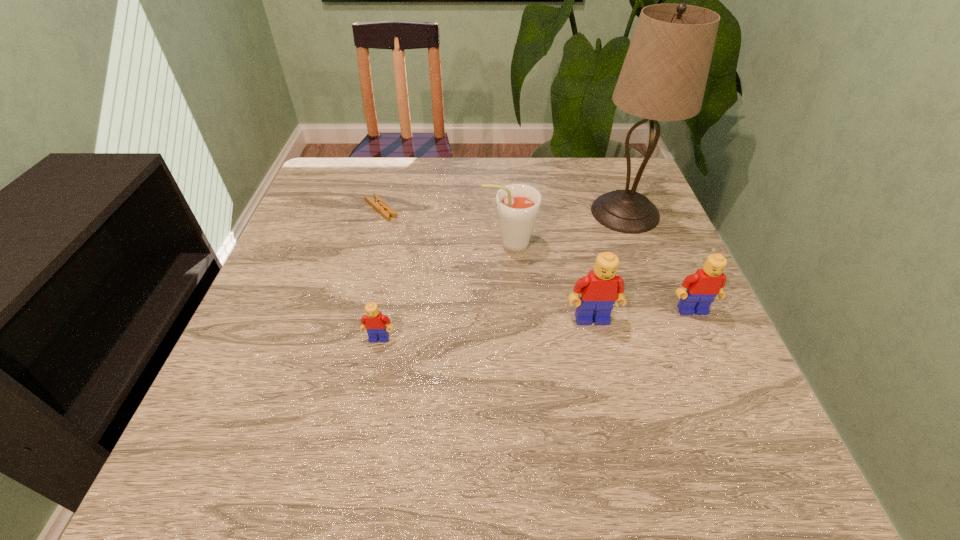
This screenshot has height=540, width=960. What are the coordinates of `free space at the near left corner of the desktop` in the screenshot? It's located at (272, 416).

You are a GUI agent. You are given a task and a screenshot of the screen. Output one action in this format:
    pyautogui.click(x=<x>, y=<y>)
    Task: Click on the free space at the far right corner
    
    Given the screenshot: What is the action you would take?
    pyautogui.click(x=624, y=159)

Image resolution: width=960 pixels, height=540 pixels. What are the coordinates of `empty space between the third object from right to left and the shortest Lego` in the screenshot? It's located at (486, 329).

Find the location of a particular element. The height and width of the screenshot is (540, 960). free space between the clothespin and the root beer is located at coordinates (444, 227).

Locate an element on the screen. Image resolution: width=960 pixels, height=540 pixels. vacant space in between the lampshade and the third object from left to right is located at coordinates (567, 228).

Where is `vacant point located between the shortest Lego and the second tallest Lego`? The width and height of the screenshot is (960, 540). vacant point located between the shortest Lego and the second tallest Lego is located at coordinates (x=536, y=325).

Locate an element on the screen. Image resolution: width=960 pixels, height=540 pixels. vacant area between the second Lego from right to left and the nearest object is located at coordinates (486, 329).

The image size is (960, 540). In order to click on vacant area that lies between the clothespin and the nearest Lego in this screenshot , I will do `click(380, 274)`.

Where is `vacant space in between the second tallest Lego and the third object from right to left`? This screenshot has width=960, height=540. vacant space in between the second tallest Lego and the third object from right to left is located at coordinates (642, 315).

The image size is (960, 540). I want to click on object that is the fourth closest to the third object from left to right, so click(374, 322).